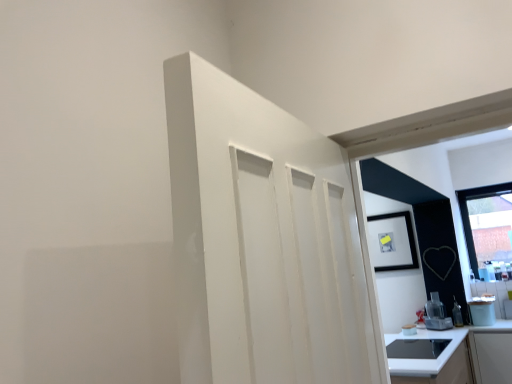
Question: Is transparent glass window at upper right beside white glossy countertop at lower right?

Choices:
 (A) no
 (B) yes

Answer: (A)

Question: Considering the relative sizes of transparent glass window at upper right and white glossy countertop at lower right in the image provided, is transparent glass window at upper right smaller than white glossy countertop at lower right?

Choices:
 (A) yes
 (B) no

Answer: (A)

Question: From the image's perspective, is transparent glass window at upper right beneath white glossy countertop at lower right?

Choices:
 (A) yes
 (B) no

Answer: (B)

Question: From a real-world perspective, is transparent glass window at upper right located higher than white glossy countertop at lower right?

Choices:
 (A) no
 (B) yes

Answer: (B)

Question: Does transparent glass window at upper right appear on the left side of white glossy countertop at lower right?

Choices:
 (A) yes
 (B) no

Answer: (B)

Question: Is transparent glass window at upper right at the right side of white glossy countertop at lower right?

Choices:
 (A) no
 (B) yes

Answer: (B)

Question: Considering the relative positions of satin silver blender at lower right, the 1th appliance positioned from the left, and transparent glass window at upper right in the image provided, is satin silver blender at lower right, the 1th appliance positioned from the left, to the left of transparent glass window at upper right from the viewer's perspective?

Choices:
 (A) no
 (B) yes

Answer: (B)

Question: Does satin silver blender at lower right, which is the second appliance from right to left, have a lesser height compared to transparent glass window at upper right?

Choices:
 (A) yes
 (B) no

Answer: (A)

Question: Is satin silver blender at lower right, the 1th appliance positioned from the left, bigger than transparent glass window at upper right?

Choices:
 (A) yes
 (B) no

Answer: (B)

Question: Considering the relative sizes of satin silver blender at lower right, the 1th appliance positioned from the left, and transparent glass window at upper right in the image provided, is satin silver blender at lower right, the 1th appliance positioned from the left, taller than transparent glass window at upper right?

Choices:
 (A) yes
 (B) no

Answer: (B)

Question: Is satin silver blender at lower right, which is the second appliance from right to left, to the right of transparent glass window at upper right from the viewer's perspective?

Choices:
 (A) yes
 (B) no

Answer: (B)

Question: Considering the relative sizes of satin silver blender at lower right, the 1th appliance positioned from the left, and transparent glass window at upper right in the image provided, is satin silver blender at lower right, the 1th appliance positioned from the left, smaller than transparent glass window at upper right?

Choices:
 (A) yes
 (B) no

Answer: (A)

Question: Considering the relative positions of satin silver blender at lower right, which is the second appliance from right to left, and white glossy countertop at lower right in the image provided, is satin silver blender at lower right, which is the second appliance from right to left, behind white glossy countertop at lower right?

Choices:
 (A) no
 (B) yes

Answer: (B)